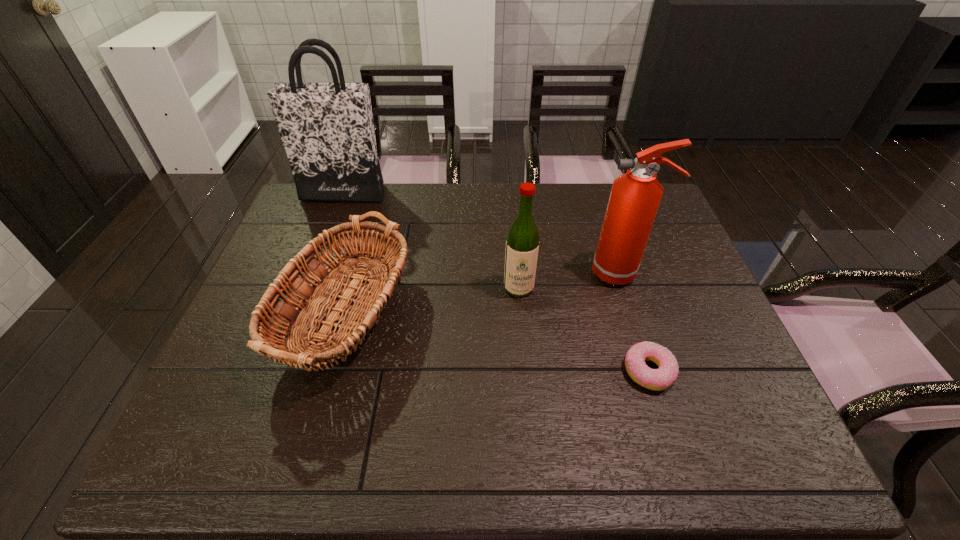
Image resolution: width=960 pixels, height=540 pixels. Find the location of `unoccupied position between the tallest object and the liquor`. unoccupied position between the tallest object and the liquor is located at coordinates (431, 240).

At what (x,y) coordinates should I click in order to perform the action: click on free spot between the doughnut and the third object from left to right. Please return your answer as a coordinate pair (x, y). Image resolution: width=960 pixels, height=540 pixels. Looking at the image, I should click on (584, 329).

Locate an element on the screen. empty space between the doughnut and the third tallest object is located at coordinates (584, 329).

Find the location of a particular element. This screenshot has width=960, height=540. free spot between the shopping bag and the third object from left to right is located at coordinates (431, 240).

Locate an element on the screen. This screenshot has width=960, height=540. vacant area that lies between the fourth shortest object and the tallest object is located at coordinates (483, 233).

What are the coordinates of `vacant area that lies between the fire extinguisher and the doughnut` in the screenshot? It's located at (636, 322).

The width and height of the screenshot is (960, 540). Identify the location of free space that is in between the second shortest object and the fire extinguisher. (479, 298).

The width and height of the screenshot is (960, 540). I want to click on object that stands as the third closest to the tallest object, so click(x=635, y=196).

What are the coordinates of `object that is the closest to the doughnut` in the screenshot? It's located at (635, 196).

At what (x,y) coordinates should I click in order to perform the action: click on vacant point that satisfies the following two spatial constraints: 1. at the nozzle of the fire extinguisher; 2. on the front side of the shortest object. Please return your answer as a coordinate pair (x, y). The width and height of the screenshot is (960, 540). Looking at the image, I should click on (655, 371).